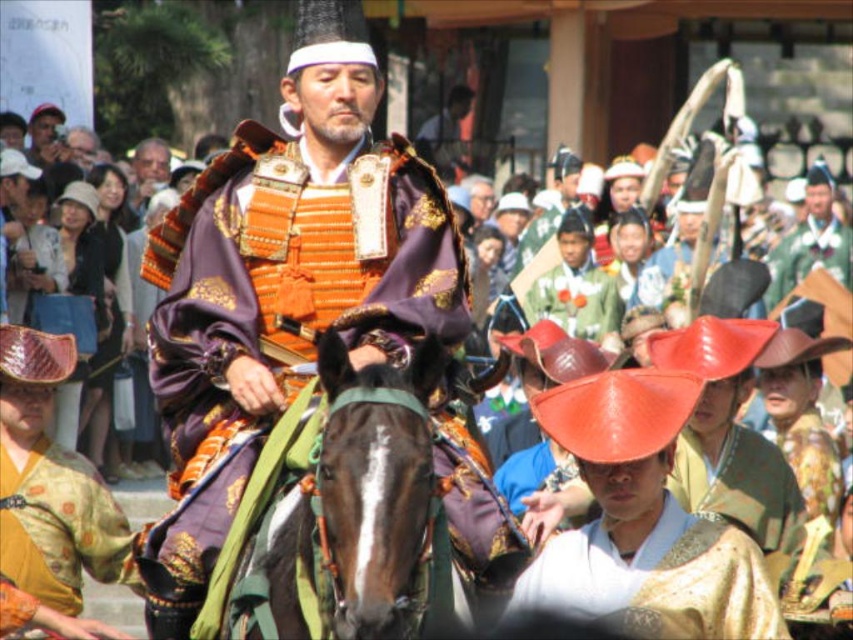
Question: Can you confirm if orange metallic armor at center is thinner than brown glossy horse at center?

Choices:
 (A) no
 (B) yes

Answer: (A)

Question: Which object is farther from the camera taking this photo?

Choices:
 (A) orange metallic armor at center
 (B) gold textured kimono at center
 (C) brown glossy horse at center

Answer: (B)

Question: From the image, what is the correct spatial relationship of brown glossy horse at center in relation to gold textured kimono at center?

Choices:
 (A) above
 (B) below

Answer: (A)

Question: Based on their relative distances, which object is farther from the orange metallic armor at center?

Choices:
 (A) brown glossy horse at center
 (B) gold textured kimono at center

Answer: (A)

Question: In this image, where is orange metallic armor at center located relative to gold textured kimono at center?

Choices:
 (A) right
 (B) left

Answer: (B)

Question: Which point appears farthest from the camera in this image?

Choices:
 (A) (677, 515)
 (B) (254, 221)

Answer: (A)